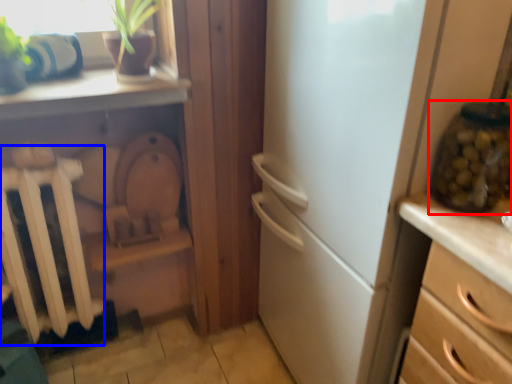
Question: Among these objects, which one is farthest to the camera, glass jar (highlighted by a red box) or radiator (highlighted by a blue box)?

Choices:
 (A) glass jar
 (B) radiator

Answer: (B)